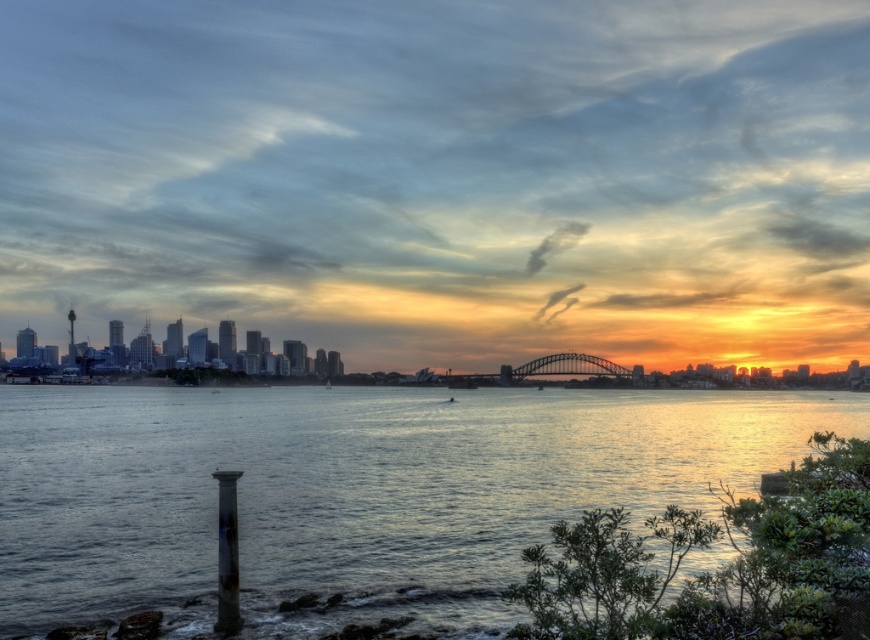
You are standing on the shore and want to place a small floating dock on the smooth water at center. According to the coordinates provided, where exactly should you place it?

You should place the small floating dock at the coordinates point (351, 492) where the smooth water at center is located.

You are a photographer standing at the shore. You want to take a photo of the smooth water at center and the metallic steel bridge at center. How far apart are these two objects in the scene?

The smooth water at center is 521.01 feet away from the metallic steel bridge at center.